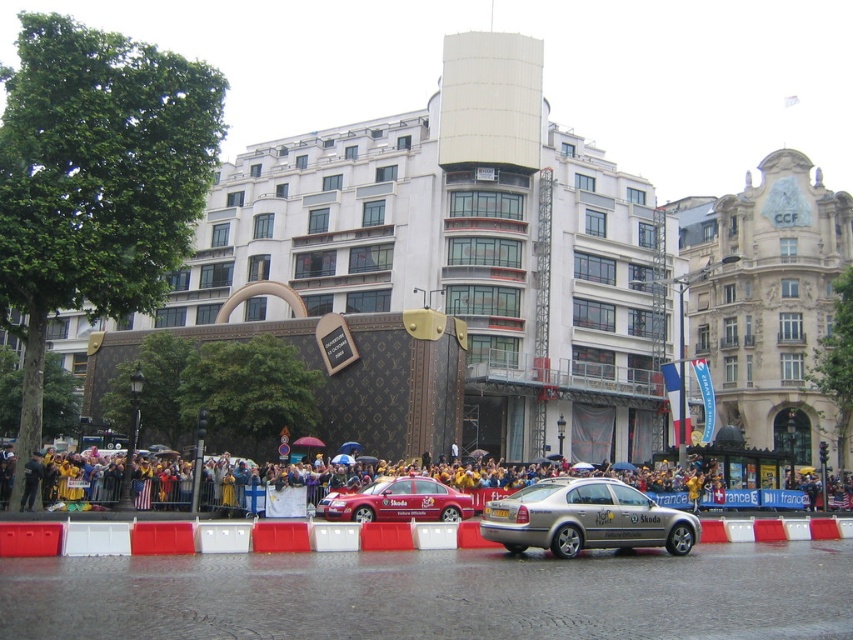
Question: Which of the following is the farthest from the observer?

Choices:
 (A) yellow fabric crowd at lower center
 (B) metallic red car at center
 (C) silver metallic car at center

Answer: (A)

Question: Which point appears farthest from the camera in this image?

Choices:
 (A) (180, 502)
 (B) (608, 492)

Answer: (A)

Question: Is yellow fabric crowd at lower center in front of silver metallic car at center?

Choices:
 (A) no
 (B) yes

Answer: (A)

Question: Which point is closer to the camera?

Choices:
 (A) yellow fabric crowd at lower center
 (B) metallic red car at center
 (C) silver metallic car at center

Answer: (C)

Question: Is yellow fabric crowd at lower center thinner than silver metallic car at center?

Choices:
 (A) no
 (B) yes

Answer: (A)

Question: In this image, where is yellow fabric crowd at lower center located relative to metallic red car at center?

Choices:
 (A) above
 (B) below

Answer: (B)